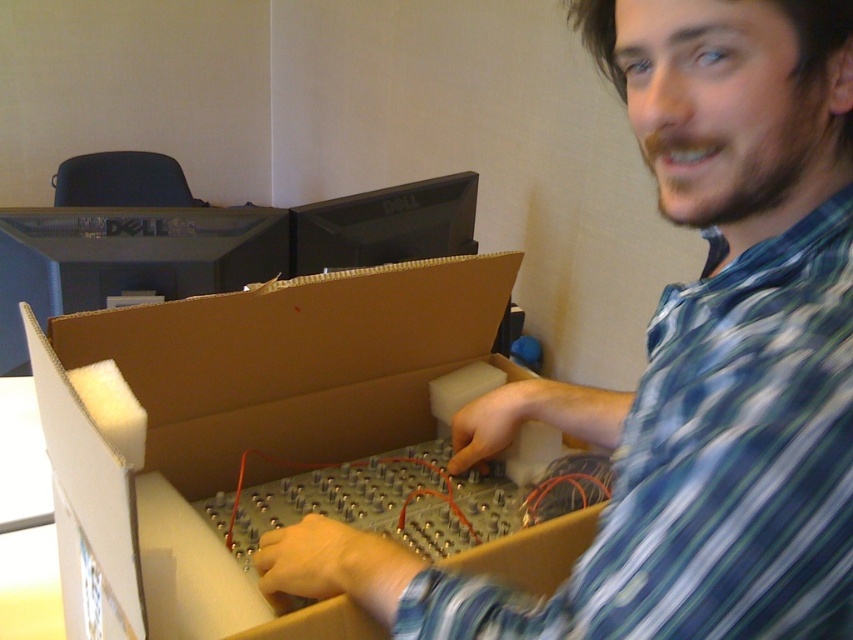
You are standing in the workspace shown in the image. There are two points marked in the scene. The first point is at coordinate point (693, 362) and the second point is at coordinate point (225, 529). Which point is closer to you?

Point (693, 362) is closer to the viewer than point (225, 529).

What is located at the point with coordinates (683, 362) in the image?

The point at coordinates (683, 362) corresponds to the metallic silver circuit board at center.